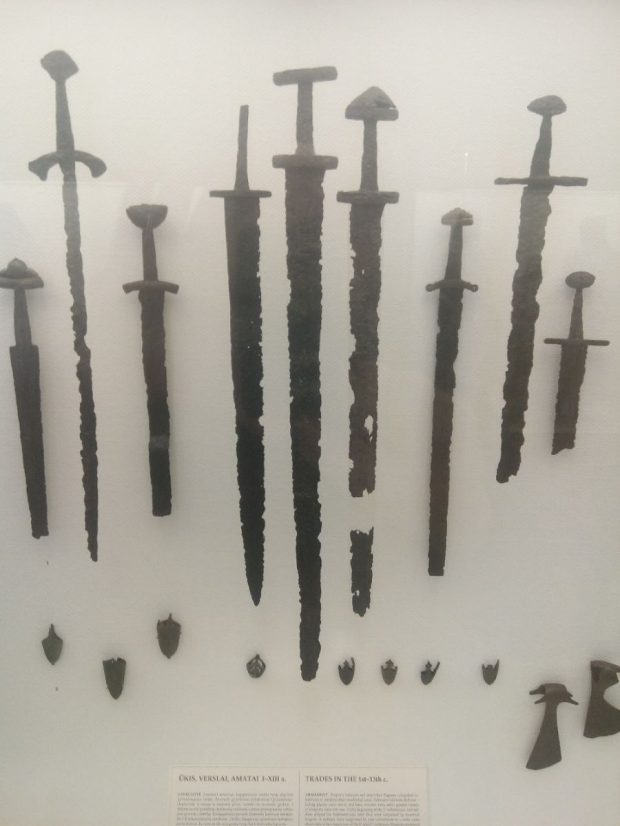
Identify the location of white wall. (466, 608).